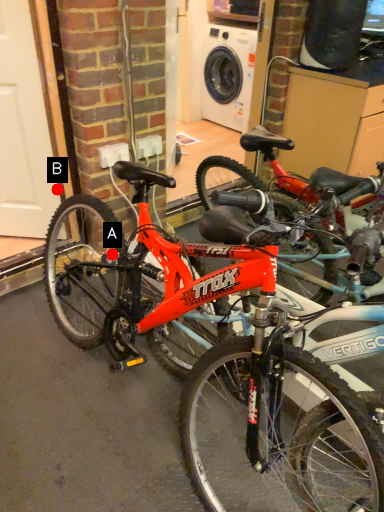
Question: Two points are circled on the image, labeled by A and B beside each circle. Which of the following is the closest to the observer?

Choices:
 (A) A is closer
 (B) B is closer

Answer: (A)